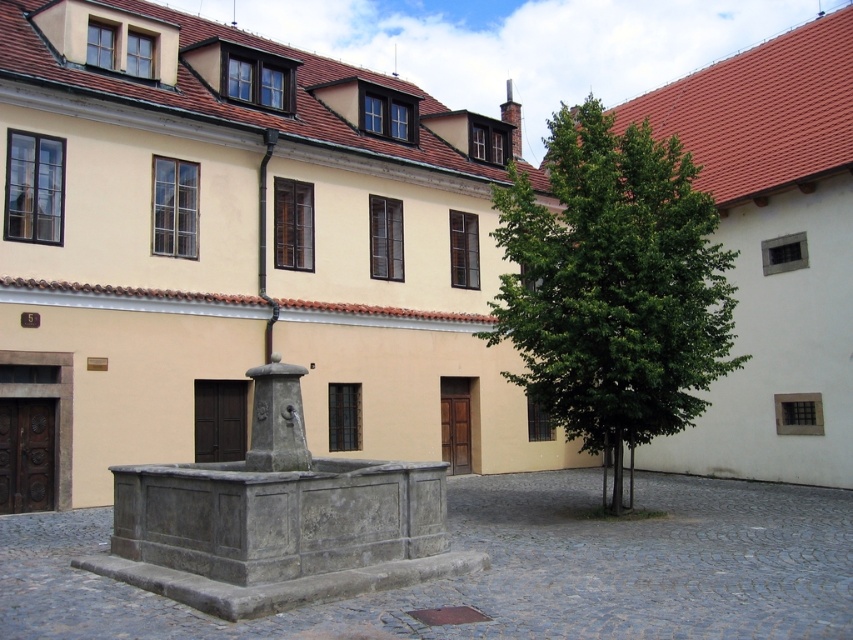
You are standing in the courtyard and want to take a photo of both the green leafy tree at center and the gray stone fountain at center. Which object should you focus on first if you want to ensure both are in the frame without moving the camera?

The green leafy tree at center is taller than the gray stone fountain at center, so focus on the tree first to ensure the entire fountain is captured within the frame.